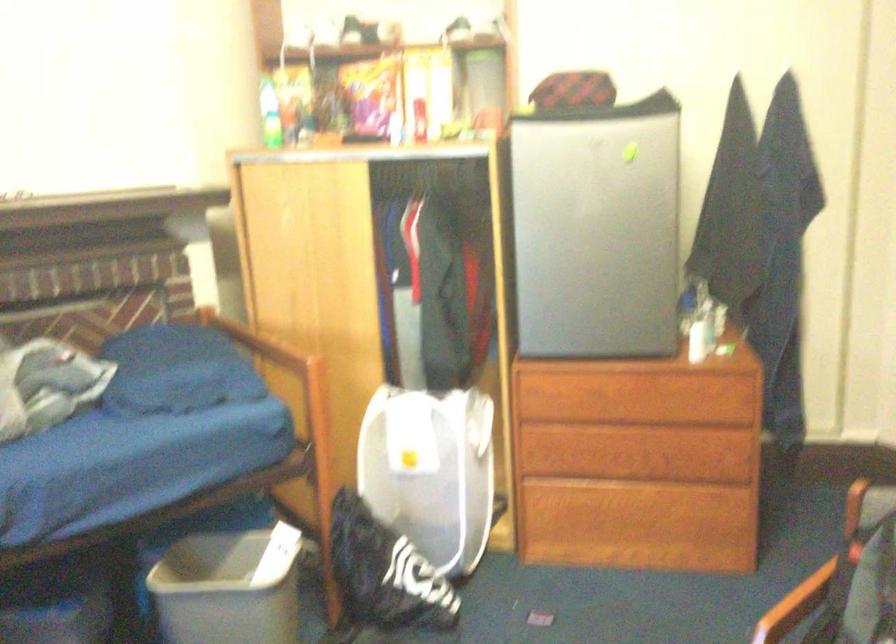
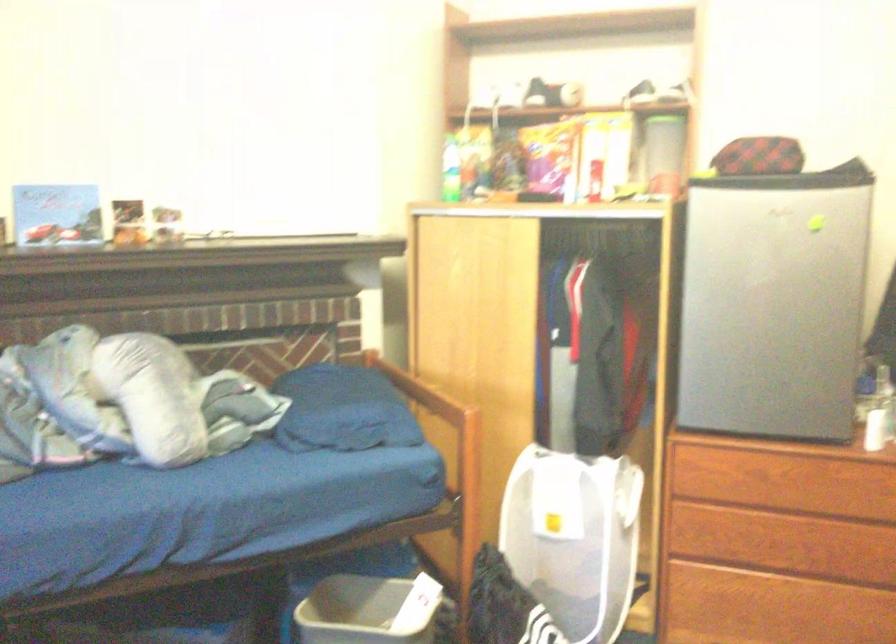
Where in the second image is the point corresponding to the point at 229,569 from the first image?

(368, 611)